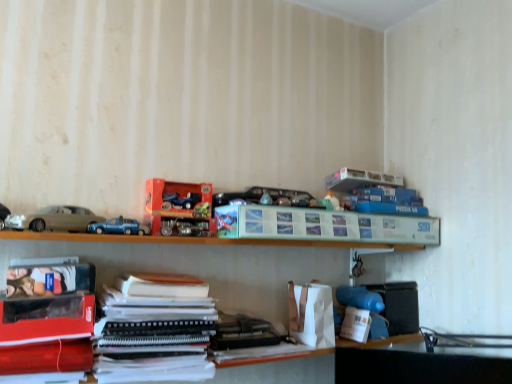
Question: From their relative heights in the image, would you say wooden shelf at lower center, positioned as the first shelf in right-to-left order, is taller or shorter than blue matte toy car at center?

Choices:
 (A) tall
 (B) short

Answer: (A)

Question: Is wooden shelf at lower center, acting as the 1th shelf starting from the bottom, in front of or behind blue matte toy car at center in the image?

Choices:
 (A) behind
 (B) front

Answer: (B)

Question: Which is farther from the matte beige car at left, which is the second car in right-to-left order?

Choices:
 (A) matte black paperback book at lower left, which ranks as the 1th paperback book in front-to-back order
 (B) matte paper paperback book at center, which is the 2th paperback book from left to right
 (C) wooden shelf at lower center, which is the 2th shelf in top-to-bottom order
 (D) white matte toy at lower right, the first toy in the bottom-to-top sequence
 (E) white paper stack at lower center

Answer: (D)

Question: Estimate the real-world distances between objects in this image. Which object is farther from the metallic car at center, the fifth toy viewed from the right?

Choices:
 (A) matte orange toy car set at center, which appears as the first shelf when viewed from the left
 (B) matte beige car at left, the 1th car in the right-to-left sequence
 (C) matte paper paperback book at center, the 1th paperback book from the back
 (D) blue matte toy car at center
 (E) white matte toy at lower right, the first toy in the bottom-to-top sequence

Answer: (B)